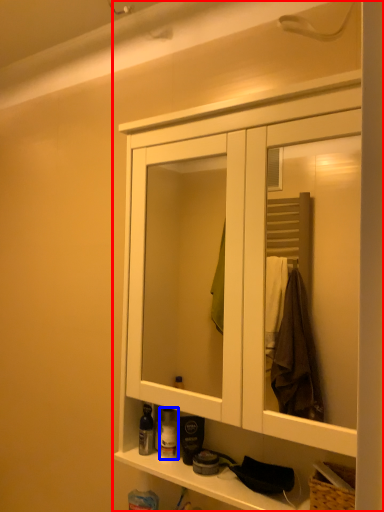
Question: Which of the following is the closest to the observer, cabinetry (highlighted by a red box) or toiletry (highlighted by a blue box)?

Choices:
 (A) cabinetry
 (B) toiletry

Answer: (A)